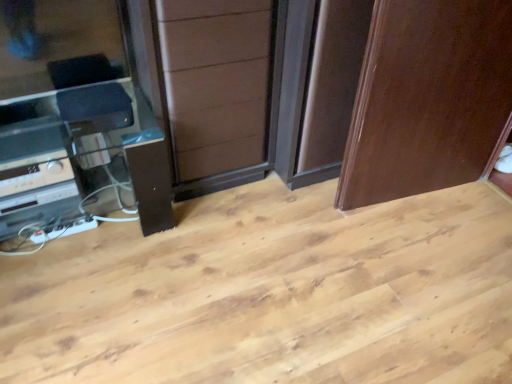
Identify the location of unoccupied region to the right of satin black entertainment center at left. The image size is (512, 384). (221, 256).